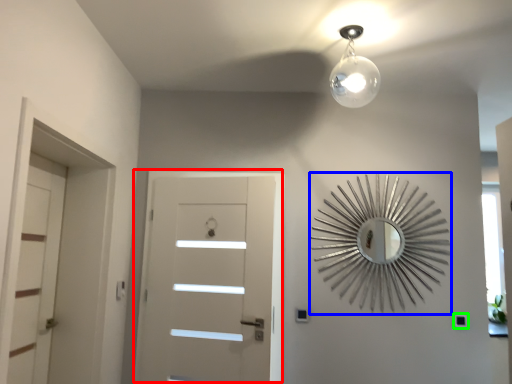
Question: Estimate the real-world distances between objects in this image. Which object is farther from door (highlighted by a red box), design (highlighted by a blue box) or light switch (highlighted by a green box)?

Choices:
 (A) design
 (B) light switch

Answer: (B)